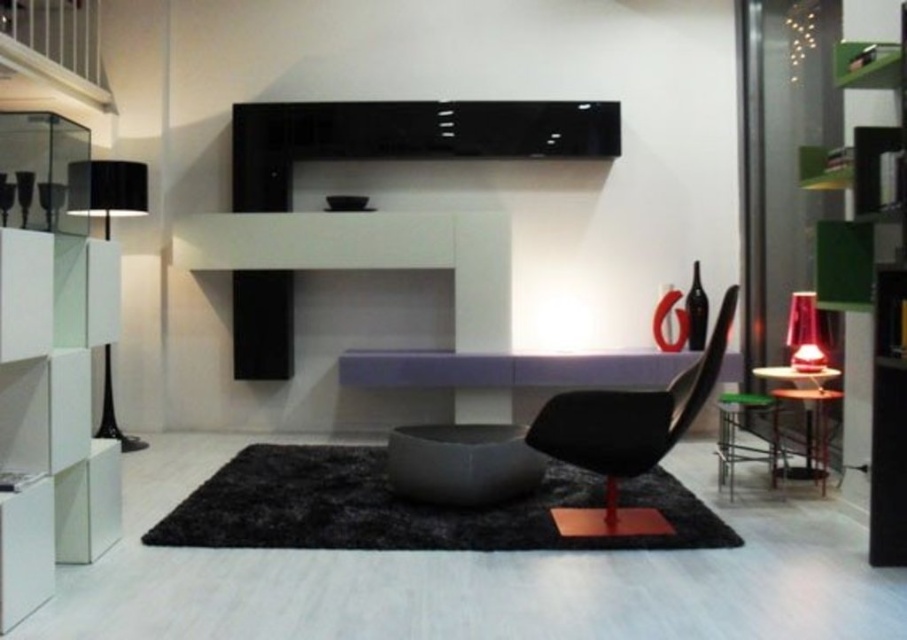
You are standing in the living room and want to place a new plant in the space. You have two spots marked as point (93, 189) and point (798, 355). According to the scene, which point is further away from you?

Point (93, 189) is behind point (798, 355), so it is further away from you.

You are standing in the living room and want to place a new plant on the black floating shelf unit. The plant needs to be placed exactly at the point marked by the coordinates point (x=626, y=435). However, the shelf currently has a small black bowl and some decorative items. Is there enough space on the shelf to place the plant at that specific coordinate?

The point (x=626, y=435) indicates the location of the black matte armchair at center, which means placing the plant there would not be possible as the armchair is already occupying that space on the shelf.

You are arranging plants in the living room and need to place a large potted plant between the green matte bookshelf at right and the metallic black side table at lower right. Based on their positions, which side of the bookshelf should you place the plant to ensure it stays within the space between them?

The green matte bookshelf at right is to the left of the metallic black side table at lower right. Therefore, placing the plant to the right side of the green matte bookshelf at right will keep it between the two objects.